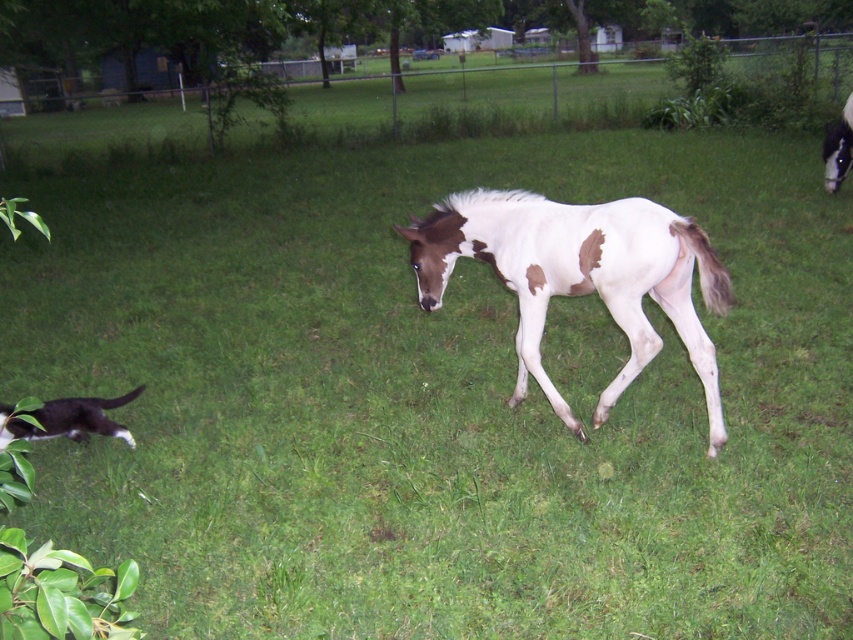
Consider the image. You are standing in the grassy outdoor scene and want to place a small flag at the point closer to you between point (62, 417) and point (844, 170). Which point should you choose?

You should choose point (62, 417) because it is closer to the viewer than point (844, 170).